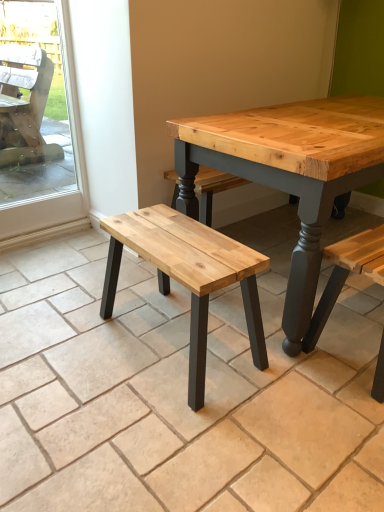
The width and height of the screenshot is (384, 512). What are the coordinates of `vacant space in natural wood bench at center (from a real-world perspective)` in the screenshot? It's located at (171, 335).